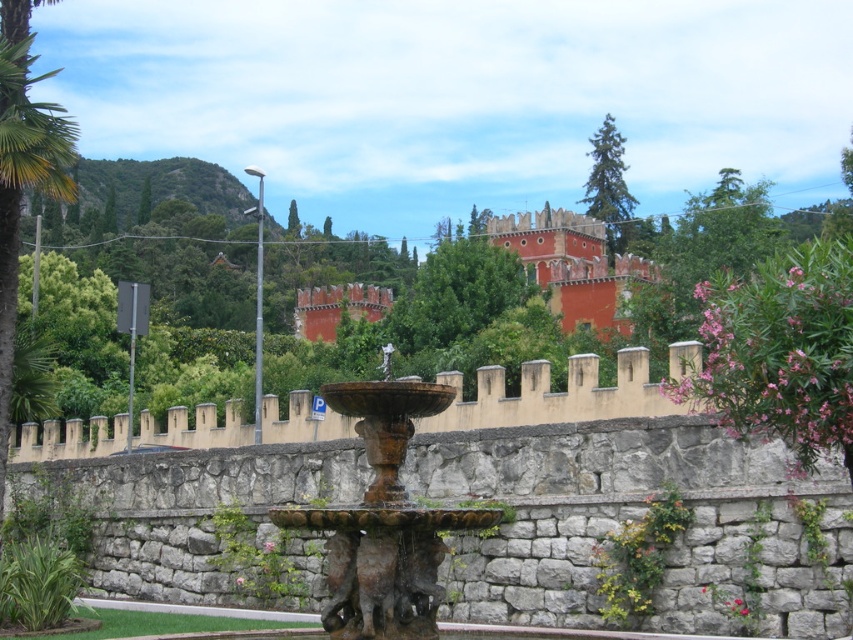
Can you confirm if pink leafy bush at right is wider than terracotta stone palace at center?

Incorrect, pink leafy bush at right's width does not surpass terracotta stone palace at center's.

Is point (712, 372) positioned in front of point (311, 333)?

Yes, it is.

What do you see at coordinates (780, 349) in the screenshot? I see `pink leafy bush at right` at bounding box center [780, 349].

Locate an element on the screen. Image resolution: width=853 pixels, height=640 pixels. pink leafy bush at right is located at coordinates (780, 349).

Between point (434, 541) and point (515, 269), which one is positioned behind?

The point (515, 269) is behind.

Describe the element at coordinates (384, 520) in the screenshot. I see `rusty stone fountain at center` at that location.

Find the location of `rusty stone fountain at center`. rusty stone fountain at center is located at coordinates pos(384,520).

Is red matte stone castle at upper center to the right of green textured tree at upper center from the viewer's perspective?

No, red matte stone castle at upper center is not to the right of green textured tree at upper center.

Describe the element at coordinates (573, 266) in the screenshot. I see `red matte stone castle at upper center` at that location.

The image size is (853, 640). I want to click on red matte stone castle at upper center, so point(573,266).